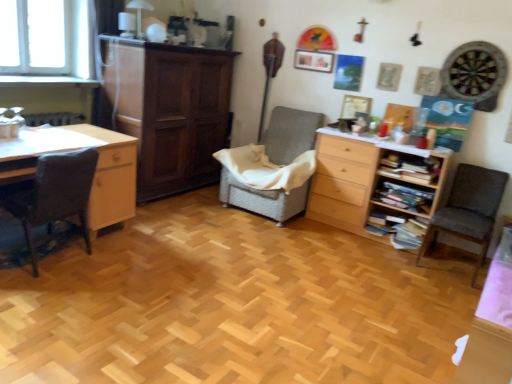
Locate an element on the screen. The image size is (512, 384). free space that is in between light wood desk at left and dark gray fabric chair at right, the first chair from the right is located at coordinates (263, 254).